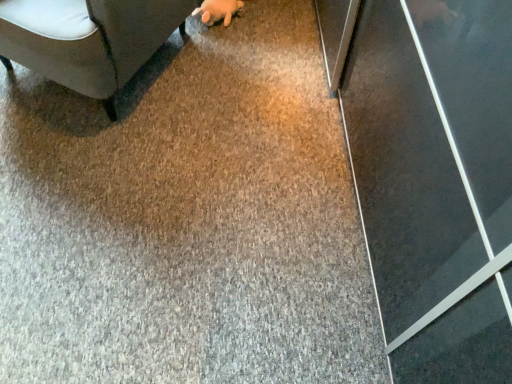
Question: Would you say dark gray fabric couch at upper left is to the left or to the right of fuzzy beige hand at upper center in the picture?

Choices:
 (A) right
 (B) left

Answer: (B)

Question: From a real-world perspective, is dark gray fabric couch at upper left physically located above or below fuzzy beige hand at upper center?

Choices:
 (A) below
 (B) above

Answer: (B)

Question: From the image's perspective, is dark gray fabric couch at upper left positioned above or below fuzzy beige hand at upper center?

Choices:
 (A) above
 (B) below

Answer: (B)

Question: Is fuzzy beige hand at upper center situated inside dark gray fabric couch at upper left or outside?

Choices:
 (A) outside
 (B) inside

Answer: (B)

Question: From a real-world perspective, relative to dark gray fabric couch at upper left, is fuzzy beige hand at upper center vertically above or below?

Choices:
 (A) above
 (B) below

Answer: (B)

Question: Relative to dark gray fabric couch at upper left, is fuzzy beige hand at upper center in front or behind?

Choices:
 (A) front
 (B) behind

Answer: (B)

Question: From the image's perspective, is fuzzy beige hand at upper center located above or below dark gray fabric couch at upper left?

Choices:
 (A) above
 (B) below

Answer: (A)